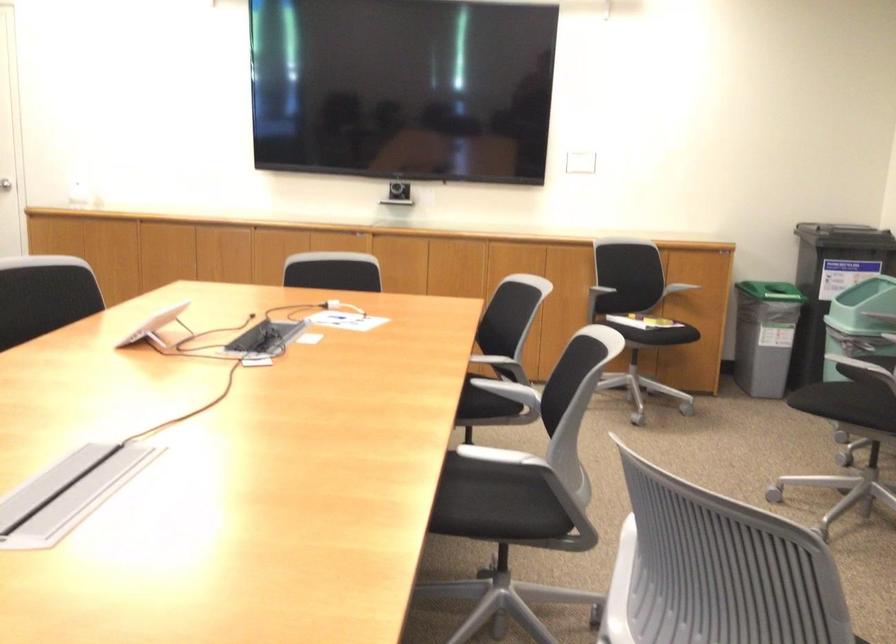
The location [399,190] corresponds to which object?

This point indicates the black webcam.